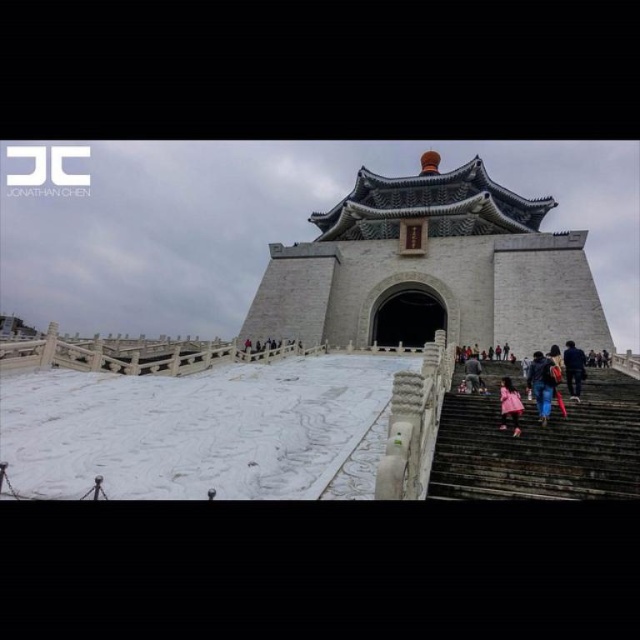
You are a visitor standing at the base of the monument. You need to decide which item, the dark blue jeans at center or the pink fabric at stairs right, you can place on a 1.5 meter wide shelf in the gift shop. Which one would fit better?

The dark blue jeans at center has a larger width than the pink fabric at stairs right. Since the shelf is 1.5 meters wide, the pink fabric at stairs right would fit better on the shelf as it is narrower than the dark blue jeans at center.